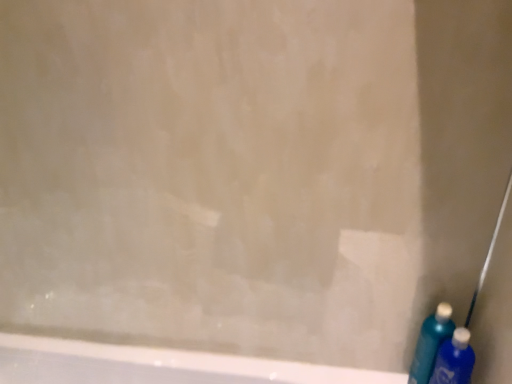
Question: Can you confirm if blue glossy bottle at lower right, the first cleaning product in the back-to-front sequence, is taller than blue plastic bottle at lower right, marked as the second cleaning product in a back-to-front arrangement?

Choices:
 (A) yes
 (B) no

Answer: (A)

Question: From a real-world perspective, does blue glossy bottle at lower right, the first cleaning product in the back-to-front sequence, sit lower than blue plastic bottle at lower right, acting as the first cleaning product starting from the front?

Choices:
 (A) no
 (B) yes

Answer: (A)

Question: Is there a large distance between blue glossy bottle at lower right, arranged as the second cleaning product when viewed from the front, and blue plastic bottle at lower right, acting as the first cleaning product starting from the front?

Choices:
 (A) no
 (B) yes

Answer: (A)

Question: Can you confirm if blue glossy bottle at lower right, arranged as the second cleaning product when viewed from the front, is shorter than blue plastic bottle at lower right, acting as the first cleaning product starting from the front?

Choices:
 (A) no
 (B) yes

Answer: (A)

Question: Is blue glossy bottle at lower right, arranged as the second cleaning product when viewed from the front, bigger than blue plastic bottle at lower right, marked as the second cleaning product in a back-to-front arrangement?

Choices:
 (A) no
 (B) yes

Answer: (A)

Question: Is blue glossy bottle at lower right, arranged as the second cleaning product when viewed from the front, to the right of blue plastic bottle at lower right, marked as the second cleaning product in a back-to-front arrangement, from the viewer's perspective?

Choices:
 (A) no
 (B) yes

Answer: (A)

Question: Does blue plastic bottle at lower right, marked as the second cleaning product in a back-to-front arrangement, lie behind blue glossy bottle at lower right, the first cleaning product in the back-to-front sequence?

Choices:
 (A) yes
 (B) no

Answer: (B)

Question: From a real-world perspective, is blue plastic bottle at lower right, acting as the first cleaning product starting from the front, positioned over blue glossy bottle at lower right, arranged as the second cleaning product when viewed from the front, based on gravity?

Choices:
 (A) no
 (B) yes

Answer: (A)

Question: Is blue plastic bottle at lower right, acting as the first cleaning product starting from the front, smaller than blue glossy bottle at lower right, arranged as the second cleaning product when viewed from the front?

Choices:
 (A) yes
 (B) no

Answer: (B)

Question: Can you confirm if blue plastic bottle at lower right, acting as the first cleaning product starting from the front, is positioned to the right of blue glossy bottle at lower right, arranged as the second cleaning product when viewed from the front?

Choices:
 (A) yes
 (B) no

Answer: (A)

Question: Is blue plastic bottle at lower right, marked as the second cleaning product in a back-to-front arrangement, completely or partially outside of blue glossy bottle at lower right, the first cleaning product in the back-to-front sequence?

Choices:
 (A) no
 (B) yes

Answer: (B)

Question: Considering the relative sizes of blue plastic bottle at lower right, marked as the second cleaning product in a back-to-front arrangement, and blue glossy bottle at lower right, arranged as the second cleaning product when viewed from the front, in the image provided, is blue plastic bottle at lower right, marked as the second cleaning product in a back-to-front arrangement, wider than blue glossy bottle at lower right, arranged as the second cleaning product when viewed from the front,?

Choices:
 (A) yes
 (B) no

Answer: (A)

Question: In the image, is blue plastic bottle at lower right, marked as the second cleaning product in a back-to-front arrangement, positioned in front of or behind blue glossy bottle at lower right, arranged as the second cleaning product when viewed from the front?

Choices:
 (A) behind
 (B) front

Answer: (B)